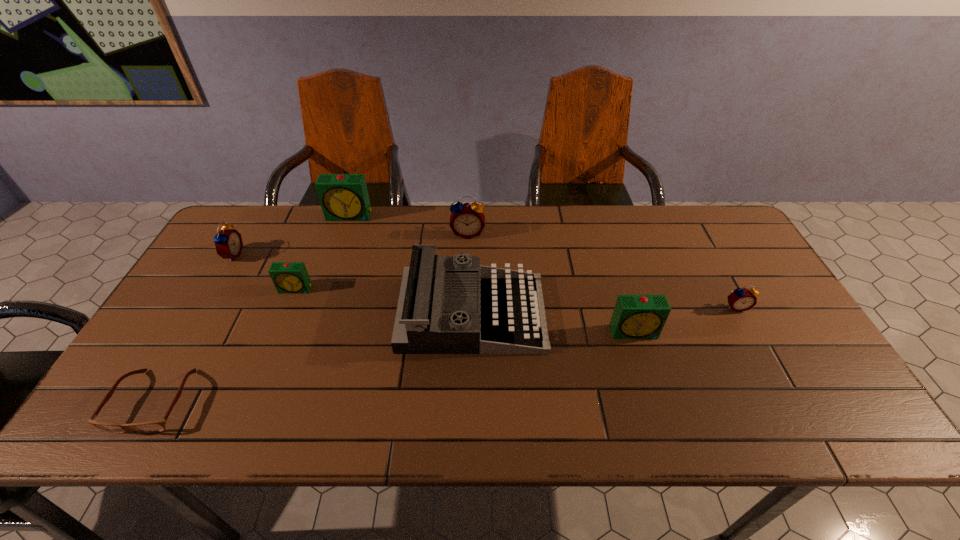
This screenshot has width=960, height=540. Find the location of `vacant space at the right edge of the desktop`. vacant space at the right edge of the desktop is located at coordinates (774, 331).

I want to click on vacant space at the near right corner, so click(x=836, y=409).

Locate an element on the screen. The height and width of the screenshot is (540, 960). empty space that is in between the typewriter and the second object from right to left is located at coordinates (553, 322).

What are the coordinates of `vacant point located between the second object from right to left and the typewriter` in the screenshot? It's located at (553, 322).

The height and width of the screenshot is (540, 960). In order to click on empty space between the fourth farthest alarm clock and the farthest object in this screenshot , I will do `click(323, 252)`.

I want to click on free point between the shortest object and the black typewriter, so click(313, 357).

Image resolution: width=960 pixels, height=540 pixels. I want to click on free space between the second farthest alarm clock and the rightmost green alarm clock, so click(x=551, y=282).

Find the location of `vacant space that is in between the sixth nearest object and the third alarm clock from right to left`. vacant space that is in between the sixth nearest object and the third alarm clock from right to left is located at coordinates (350, 244).

In order to click on the second closest object to the second biggest red alarm clock in this screenshot , I will do `click(343, 197)`.

Select which object appears as the second closest to the typewriter. Please provide its 2D coordinates. Your answer should be formatted as a tuple, i.e. [(x, y)], where the tuple contains the x and y coordinates of a point satisfying the conditions above.

[(635, 316)]